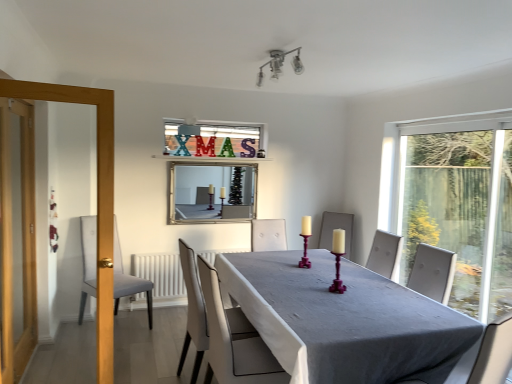
What is the approximate width of white leather chair at center, placed as the 2th chair when sorted from back to front?

52.78 centimeters.

What do you see at coordinates (338, 259) in the screenshot? This screenshot has height=384, width=512. I see `matte purple candlestick at center, positioned as the second candle holder in left-to-right order` at bounding box center [338, 259].

What do you see at coordinates (454, 201) in the screenshot?
I see `transparent glass window at right` at bounding box center [454, 201].

From the picture: What is the approximate width of gray fabric chair at left, which ranks as the 2th chair in front-to-back order?

25.59 inches.

This screenshot has height=384, width=512. Find the location of `white leather chair at center, acting as the 2th chair starting from the left`. white leather chair at center, acting as the 2th chair starting from the left is located at coordinates (226, 332).

Is metallic glass light fixture at upper center taller than wooden screen door at left?

No, metallic glass light fixture at upper center is not taller than wooden screen door at left.

Is wooden screen door at left located within metallic glass light fixture at upper center?

No, wooden screen door at left is located outside of metallic glass light fixture at upper center.

How different are the orientations of metallic glass light fixture at upper center and wooden screen door at left in degrees?

metallic glass light fixture at upper center and wooden screen door at left are facing 107 degrees away from each other.

Where is `radiator lying on the left of smooth gray table at center`? radiator lying on the left of smooth gray table at center is located at coordinates point(162,277).

Does point (292, 268) lie behind point (172, 295)?

No, it is in front of (172, 295).

Is smooth gray table at center aimed at white matte radiator at lower center?

No, smooth gray table at center is not facing towards white matte radiator at lower center.

Identify the location of light fixture located on the left of smooth gray table at center. (280, 64).

Which is in front, smooth gray table at center or metallic glass light fixture at upper center?

smooth gray table at center.

From a real-world perspective, between smooth gray table at center and metallic glass light fixture at upper center, who is vertically higher?

From a 3D spatial view, metallic glass light fixture at upper center is above.

Is point (296, 361) positioned behind point (300, 66)?

No, it is in front of (300, 66).

Considering the relative sizes of matte purple candlestick at center, the 2th candle holder viewed from the back, and white matte radiator at lower center in the image provided, is matte purple candlestick at center, the 2th candle holder viewed from the back, smaller than white matte radiator at lower center?

Indeed, matte purple candlestick at center, the 2th candle holder viewed from the back, has a smaller size compared to white matte radiator at lower center.

Are matte purple candlestick at center, placed as the first candle holder when sorted from front to back, and white matte radiator at lower center beside each other?

matte purple candlestick at center, placed as the first candle holder when sorted from front to back, is not next to white matte radiator at lower center, and they're not touching.

Considering the relative positions of matte purple candlestick at center, the 2th candle holder viewed from the back, and white matte radiator at lower center in the image provided, is matte purple candlestick at center, the 2th candle holder viewed from the back, to the left or to the right of white matte radiator at lower center?

Based on their positions, matte purple candlestick at center, the 2th candle holder viewed from the back, is located to the right of white matte radiator at lower center.

Does white leather chair at center, placed as the 2th chair when sorted from back to front, appear on the right side of purple wood candle holder at center, placed as the 2th candle holder when sorted from right to left?

In fact, white leather chair at center, placed as the 2th chair when sorted from back to front, is to the left of purple wood candle holder at center, placed as the 2th candle holder when sorted from right to left.

This screenshot has height=384, width=512. Identify the location of the 2nd candle holder positioned above the white leather chair at center, which ranks as the 1th chair in right-to-left order (from the image's perspective). (305, 241).

Who is bigger, white leather chair at center, acting as the 2th chair starting from the left, or purple wood candle holder at center, the first candle holder from the left?

Bigger between the two is white leather chair at center, acting as the 2th chair starting from the left.

Considering the sizes of white leather chair at center, acting as the 2th chair starting from the left, and white matte radiator at lower center in the image, is white leather chair at center, acting as the 2th chair starting from the left, wider or thinner than white matte radiator at lower center?

white leather chair at center, acting as the 2th chair starting from the left, is wider than white matte radiator at lower center.

Would you consider white leather chair at center, acting as the 1th chair starting from the front, to be distant from white matte radiator at lower center?

Indeed, white leather chair at center, acting as the 1th chair starting from the front, is not near white matte radiator at lower center.

From a real-world perspective, which is physically above, white leather chair at center, acting as the 2th chair starting from the left, or white matte radiator at lower center?

In real-world perspective, white leather chair at center, acting as the 2th chair starting from the left, is above.

Based on the photo, does white leather chair at center, placed as the 2th chair when sorted from back to front, have a greater height compared to white matte radiator at lower center?

Yes.

Is matte purple candlestick at center, positioned as the second candle holder in left-to-right order, spatially inside metallic glass light fixture at upper center, or outside of it?

matte purple candlestick at center, positioned as the second candle holder in left-to-right order, is located beyond the bounds of metallic glass light fixture at upper center.

Does point (334, 254) appear closer or farther from the camera than point (281, 71)?

Clearly, point (334, 254) is closer to the camera than point (281, 71).

Does matte purple candlestick at center, acting as the 1th candle holder starting from the right, have a lesser height compared to metallic glass light fixture at upper center?

No, matte purple candlestick at center, acting as the 1th candle holder starting from the right, is not shorter than metallic glass light fixture at upper center.

At what (x,y) coordinates should I click in order to perform the action: click on screen door that appears below the metallic glass light fixture at upper center (from the image's perspective). Please return your answer as a coordinate pair (x, y). Looking at the image, I should click on (97, 197).

This screenshot has height=384, width=512. Identify the location of radiator lying on the left of smooth gray table at center. (162, 277).

From the image, which object appears to be farther from smooth gray table at center, purple wood candle holder at center, placed as the 2th candle holder when sorted from right to left, or white leather chair at center, acting as the 1th chair starting from the front?

purple wood candle holder at center, placed as the 2th candle holder when sorted from right to left, lies further to smooth gray table at center than the other object.

Based on their spatial positions, is wooden screen door at left or smooth gray table at center closer to white leather chair at center, which ranks as the 1th chair in right-to-left order?

The object closer to white leather chair at center, which ranks as the 1th chair in right-to-left order, is smooth gray table at center.

Estimate the real-world distances between objects in this image. Which object is closer to white matte radiator at lower center, matte purple candlestick at center, positioned as the second candle holder in left-to-right order, or gray fabric chair at left, which is counted as the 2th chair, starting from the right?

gray fabric chair at left, which is counted as the 2th chair, starting from the right, is positioned closer to the anchor white matte radiator at lower center.

From the image, which object appears to be nearer to purple wood candle holder at center, the first candle holder from the left, transparent glass window at right or metallic glass light fixture at upper center?

metallic glass light fixture at upper center is closer to purple wood candle holder at center, the first candle holder from the left.

From the image, which object appears to be nearer to gray fabric chair at left, which ranks as the 2th chair in front-to-back order, smooth gray table at center or matte purple candlestick at center, acting as the 1th candle holder starting from the right?

smooth gray table at center is closer to gray fabric chair at left, which ranks as the 2th chair in front-to-back order.

Considering their positions, is white leather chair at center, acting as the 2th chair starting from the left, positioned closer to purple wood candle holder at center, the second candle holder in the front-to-back sequence, than silver/glass mirror at upper center?

The object closer to purple wood candle holder at center, the second candle holder in the front-to-back sequence, is white leather chair at center, acting as the 2th chair starting from the left.

Considering their positions, is matte purple candlestick at center, placed as the first candle holder when sorted from front to back, positioned closer to silver/glass mirror at upper center than wooden screen door at left?

wooden screen door at left is closer to silver/glass mirror at upper center.

Looking at the image, which one is located closer to white matte radiator at lower center, smooth gray table at center or silver/glass mirror at upper center?

Based on the image, silver/glass mirror at upper center appears to be nearer to white matte radiator at lower center.

At what (x,y) coordinates should I click in order to perform the action: click on table between gray fabric chair at left, the first chair positioned from the back, and matte purple candlestick at center, positioned as the second candle holder in left-to-right order. Please return your answer as a coordinate pair (x, y). The width and height of the screenshot is (512, 384). Looking at the image, I should click on click(x=345, y=320).

The height and width of the screenshot is (384, 512). In order to click on light fixture between white leather chair at center, acting as the 2th chair starting from the left, and silver/glass mirror at upper center in the front-back direction in this screenshot , I will do `click(280, 64)`.

Image resolution: width=512 pixels, height=384 pixels. Identify the location of screen door located between gray fabric chair at left, the 1th chair viewed from the left, and transparent glass window at right in the left-right direction. (97, 197).

You are a GUI agent. You are given a task and a screenshot of the screen. Output one action in this format:
    pyautogui.click(x=<x>, y=<y>)
    Task: Click on the candle holder between white leather chair at center, acting as the 2th chair starting from the left, and purple wood candle holder at center, positioned as the 1th candle holder in back-to-front order, from front to back
    The image size is (512, 384).
    Given the screenshot: What is the action you would take?
    pyautogui.click(x=338, y=259)